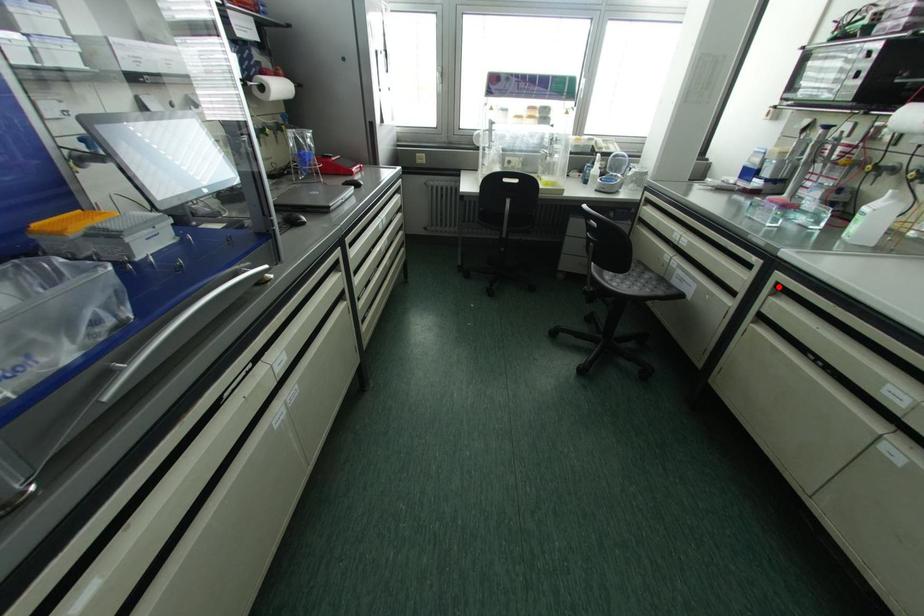
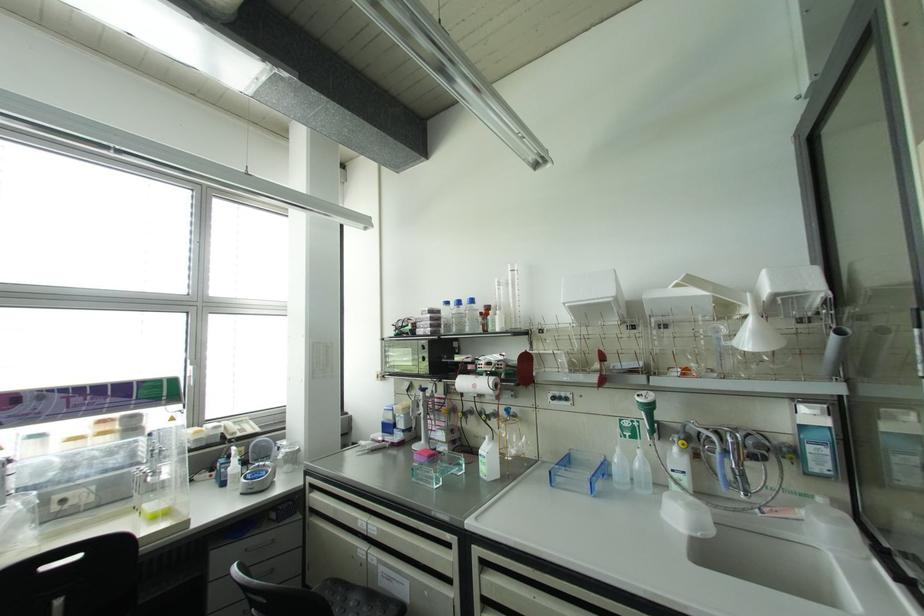
Where in the second image is the point corresponding to the highlighted location from the first image?

(482, 562)